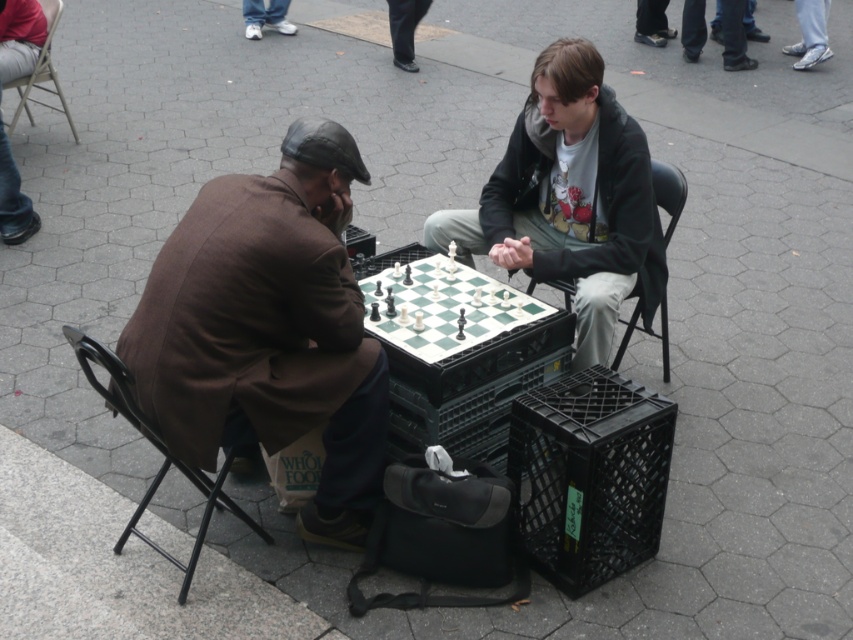
You are standing at the point marked as point (157, 449) in the image. Which object is directly in front of you?

The black metal chair at left is directly in front of you at point (157, 449).

You are standing in the park and see two points marked in the image. Which point, point (247,429) or point (67,108), is closer to you?

Point (247,429) is closer to you than point (67,108).